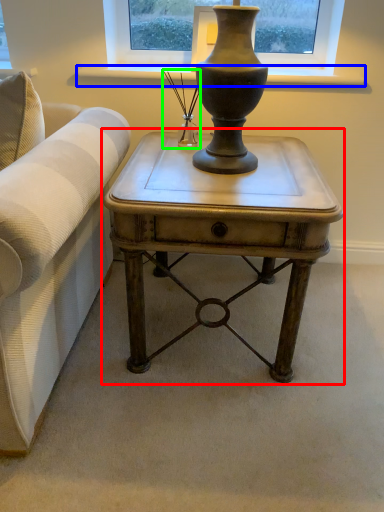
Question: Estimate the real-world distances between objects in this image. Which object is farther from table (highlighted by a red box), window sill (highlighted by a blue box) or candle holder (highlighted by a green box)?

Choices:
 (A) window sill
 (B) candle holder

Answer: (A)